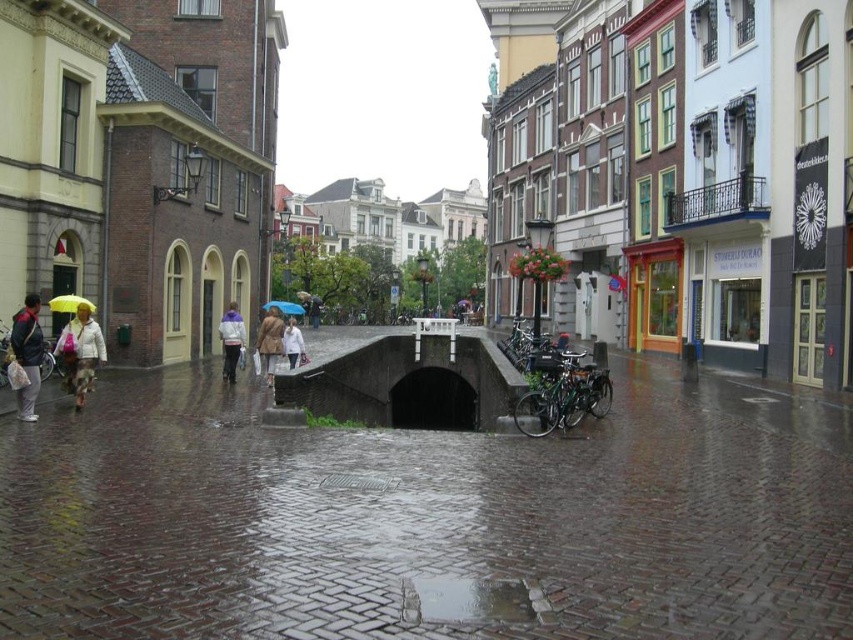
You are a tourist standing on the bridge and see both the reflective wet stone at center and the purple fleece jacket at center. Which object is closer to you?

The reflective wet stone at center is closer to you because it is positioned in front of the purple fleece jacket at center.

Consider the image. You are walking on the wet cobblestone pavement at center and want to reach the white matte jacket at left. Which direction should you move to get closer to the jacket?

You should move backward because the wet cobblestone pavement at center is in front of the white matte jacket at left, meaning the jacket is behind you relative to your current position on the pavement.